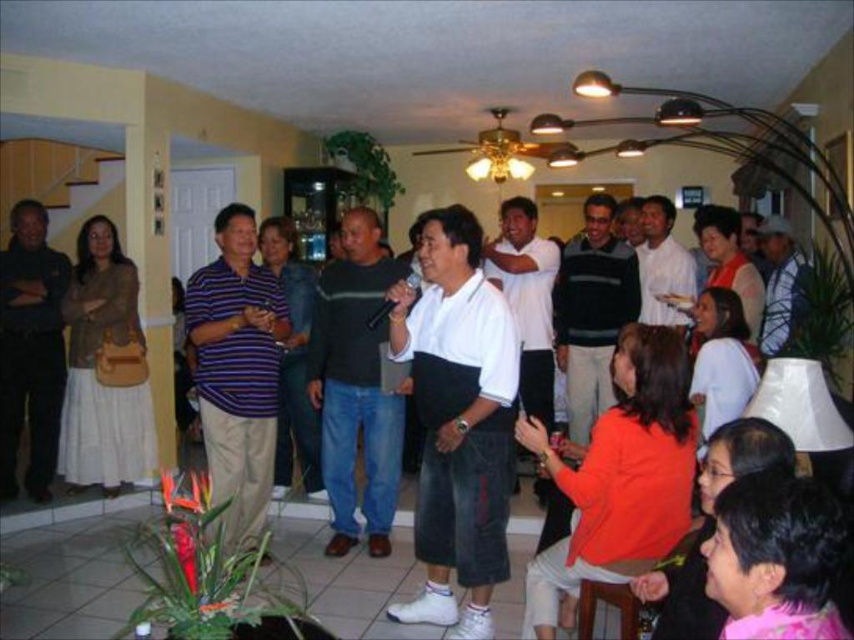
You are at the point marked as (x=237, y=371) in the image. What is the clothing item located exactly at this point?

The striped cotton shirt at center is located exactly at point (x=237, y=371).

Based on the photo, you are at a party and want to find the person wearing the white matte shirt at center. Which direction should you look relative to the dark gray sweater at center?

The white matte shirt at center is to the right of the dark gray sweater at center, so you should look to the right of the dark gray sweater at center to find the white matte shirt at center.

You are standing in the room and want to find the white matte shirt at center. According to the coordinates provided, where should you look relative to the room?

The white matte shirt at center is located at coordinates point (x=458, y=420), which is slightly to the right and center of the room.